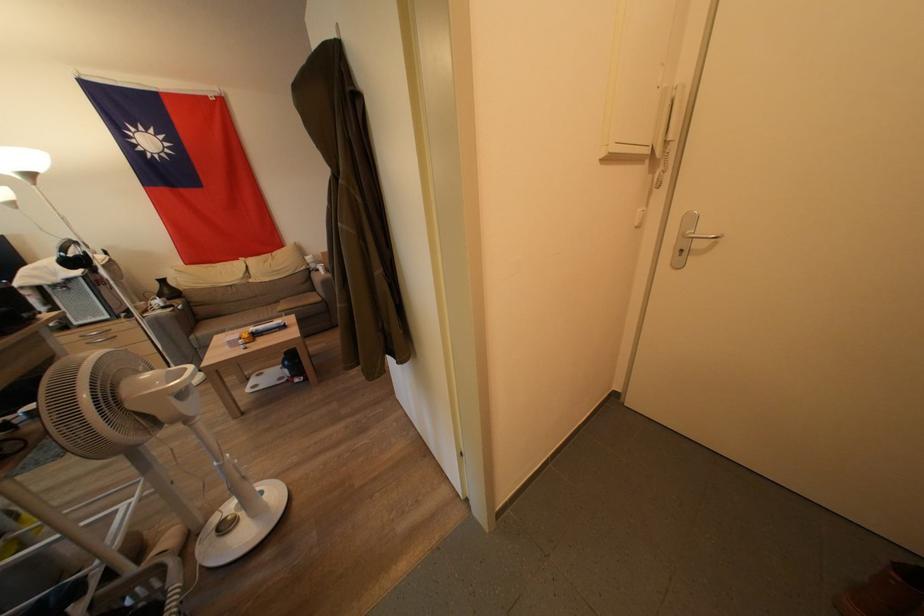
Image resolution: width=924 pixels, height=616 pixels. Describe the element at coordinates (238, 314) in the screenshot. I see `the sofa sitting surface` at that location.